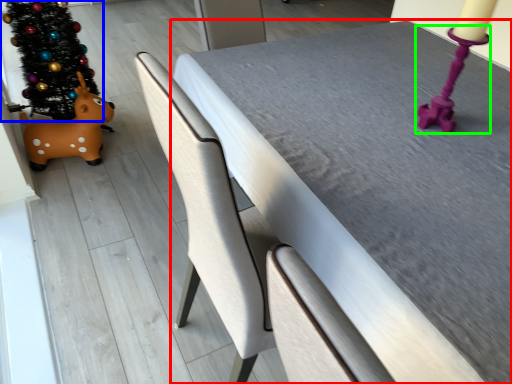
Question: Based on their relative distances, which object is nearer to table (highlighted by a red box)? Choose from christmas tree (highlighted by a blue box) and candle holder (highlighted by a green box).

Choices:
 (A) christmas tree
 (B) candle holder

Answer: (B)